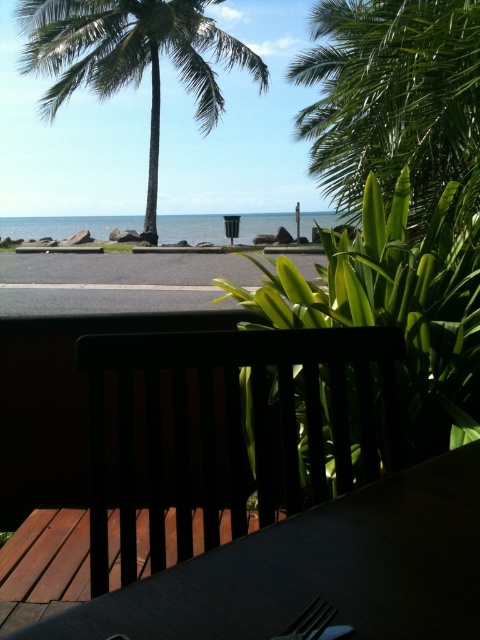
You are standing on the deck and want to place a new potted plant on the dark wood table at center. According to the scene description, where exactly should you place the potted plant?

The dark wood table at center is located at the 2D coordinates point (319, 570), so you should place the potted plant there.

You are standing on the deck and want to place a 65 feet long banner between the matte black bench at center and the green leafy palm tree at upper left. Can the banner fit between them?

The distance between the matte black bench at center and the green leafy palm tree at upper left is 65.30 feet, so the banner can fit between them with a small amount of space left over.

You are standing on the deck and want to take a photo of the green leafy palm tree at upper left and the green leafy palm tree at upper right. Which palm tree is positioned lower in the frame?

The green leafy palm tree at upper right is located below the green leafy palm tree at upper left, so it is positioned lower in the frame.